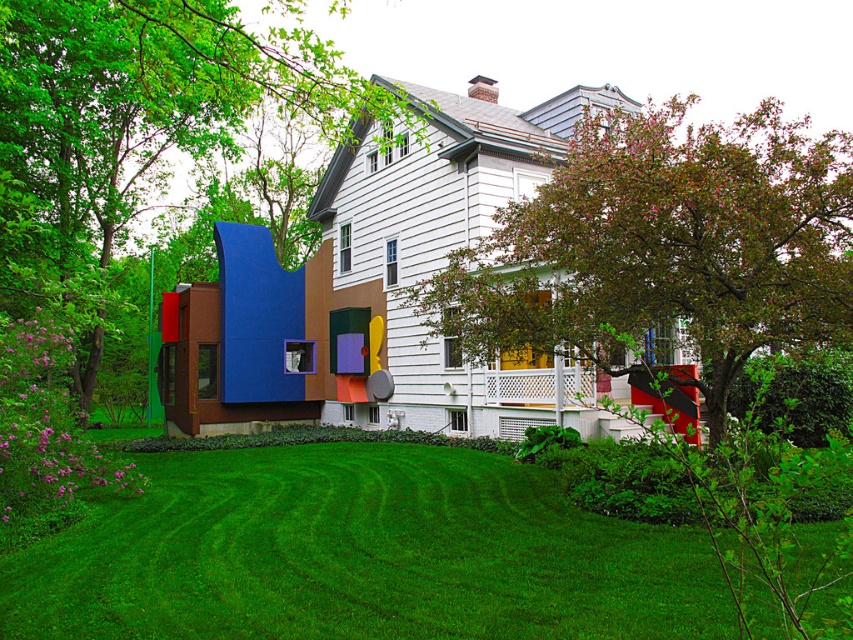
You are standing at the origin point of the coordinate system where the image is represented. You want to walk towards the green grass at lower center. What coordinates should you head to?

You should head to the coordinates point at (358, 554) to reach the green grass at lower center.